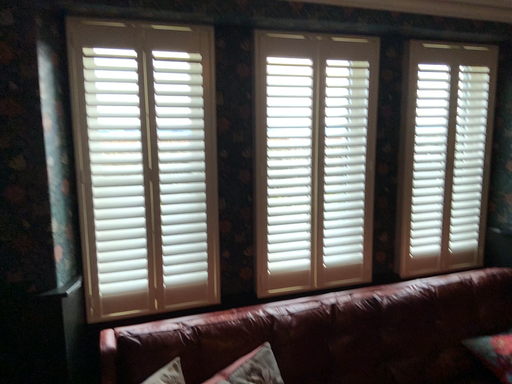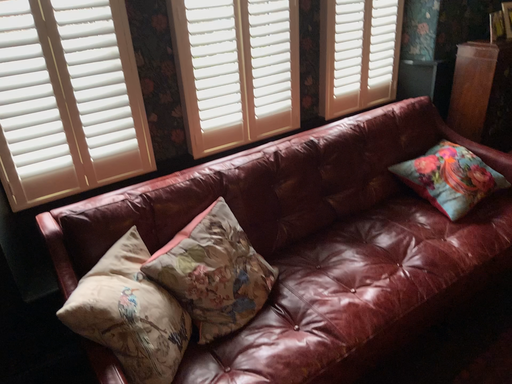
Question: How did the camera likely rotate when shooting the video?

Choices:
 (A) rotated left
 (B) rotated right

Answer: (B)